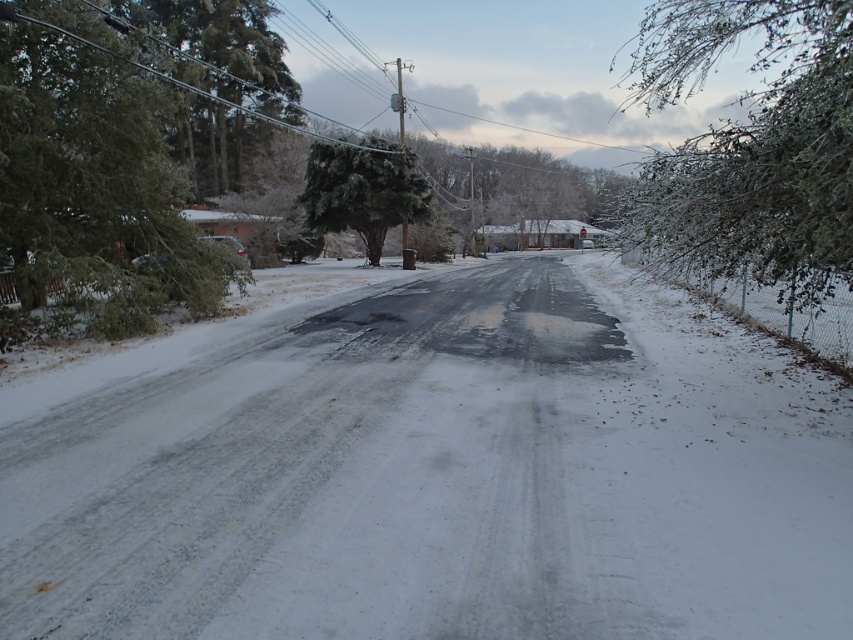
You are standing on the snowy residential street and want to walk from the point at coordinates point [207,84] to the point at coordinates point [691,186]. Which direction should you face to move towards the second point?

You should face away from the viewer because point [207,84] is closer to you than point [691,186], so moving away from your current position would lead you toward point [691,186].

Consider the image. You are a delivery person trying to navigate through the snowy street. You notice a green frosted tree at left and a green matte tree at center. Which tree would block your path more if you drive closer to the center of the road?

The green frosted tree at left has a larger size compared to the green matte tree at center, so it would block the path more if you drive closer to the center of the road.

You are standing on the snowy residential street and want to take a photo. You notice two points marked in the scene. Which point, point (165,120) or point (387,147), is closer to you?

Point (165,120) is closer to the camera than point (387,147).